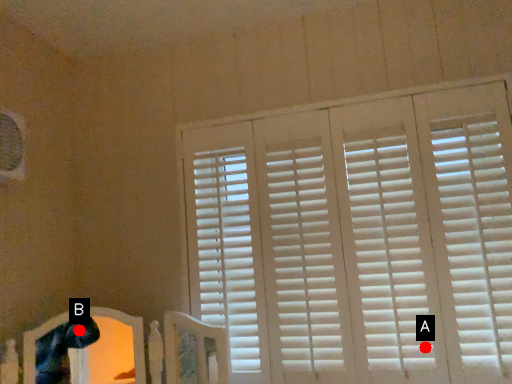
Question: Two points are circled on the image, labeled by A and B beside each circle. Which point is closer to the camera?

Choices:
 (A) A is closer
 (B) B is closer

Answer: (B)